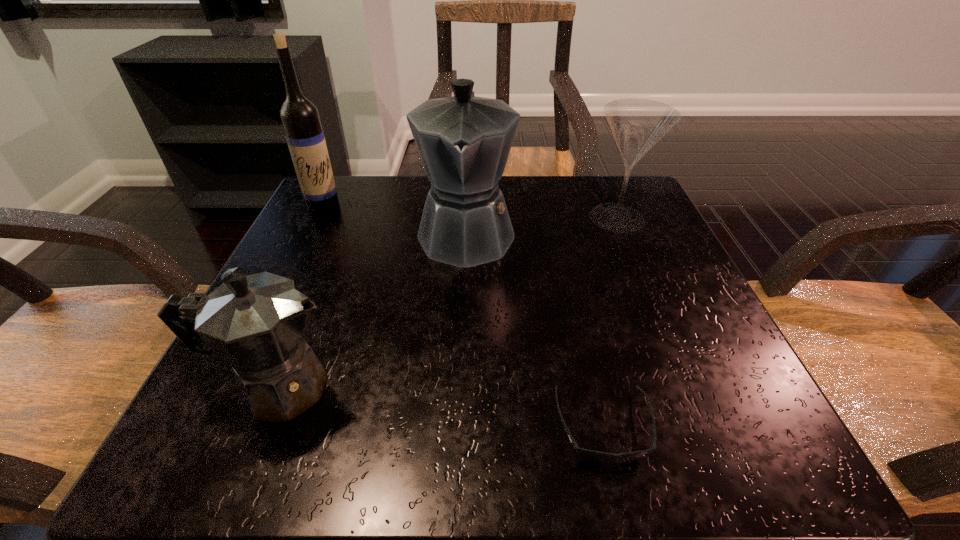
Where is `vacant point located 0.070m on the front of the flute glass`? The image size is (960, 540). vacant point located 0.070m on the front of the flute glass is located at coordinates click(x=635, y=258).

The width and height of the screenshot is (960, 540). In order to click on vacant space situated on the pouring side of the nearer coffeepot in this screenshot , I will do point(380,387).

You are a GUI agent. You are given a task and a screenshot of the screen. Output one action in this format:
    pyautogui.click(x=<x>, y=<y>)
    Task: Click on the wine bottle located at the far edge
    The image size is (960, 540).
    Given the screenshot: What is the action you would take?
    pyautogui.click(x=300, y=118)

Locate an element on the screen. The width and height of the screenshot is (960, 540). coffeepot at the far edge is located at coordinates (464, 141).

Locate an element on the screen. flute glass located in the far edge section of the desktop is located at coordinates (637, 125).

Locate an element on the screen. coffeepot situated at the near edge is located at coordinates click(255, 324).

Identify the location of sunglasses that is at the near edge. (595, 456).

Locate an element on the screen. Image resolution: width=960 pixels, height=540 pixels. wine bottle that is at the left edge is located at coordinates (300, 118).

What are the coordinates of `coffeepot situated at the left edge` in the screenshot? It's located at (255, 324).

Image resolution: width=960 pixels, height=540 pixels. Find the location of `flute glass at the right edge`. flute glass at the right edge is located at coordinates (637, 125).